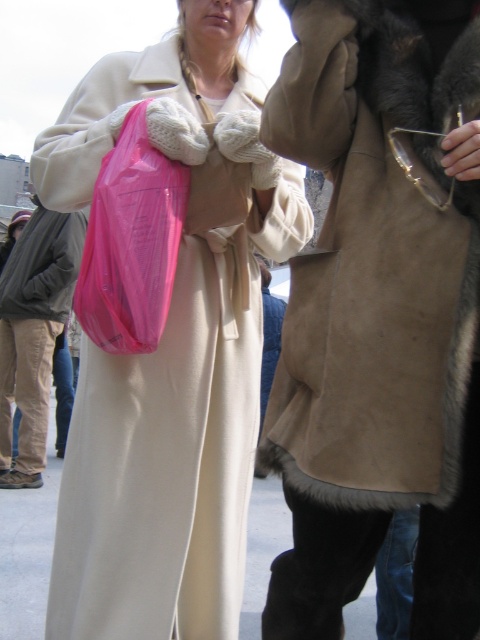
From the picture: You are standing in the scene and want to pick up both the matte plastic bag at center and the matte beige coat at lower left. Which object will you reach first?

You will reach the matte plastic bag at center first because it is closer to the viewer than the matte beige coat at lower left.

You are standing in the cold weather scene and want to determine which object is higher. You see the suede fur coat at right and the pink plastic bag at center. Which one has a greater height?

The suede fur coat at right is taller than the pink plastic bag at center.